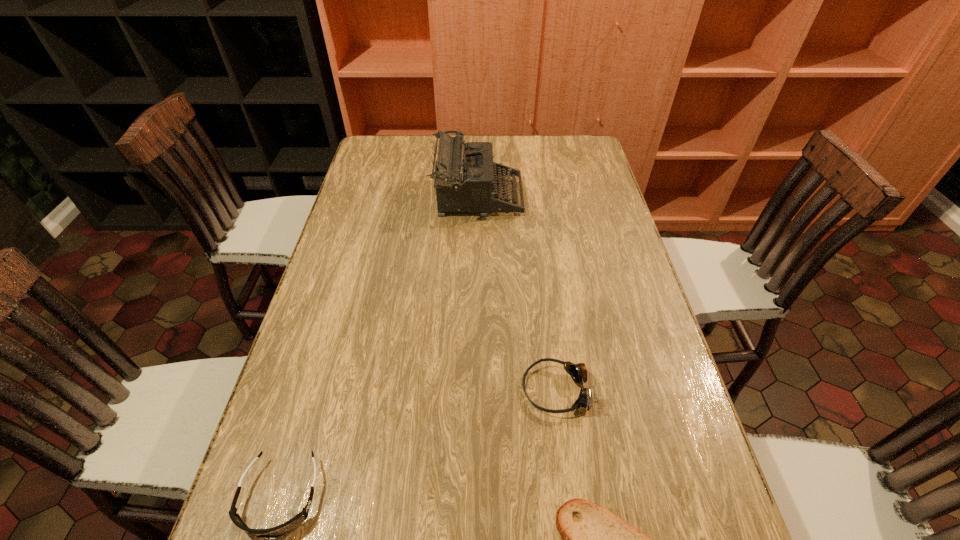
The width and height of the screenshot is (960, 540). What are the coordinates of `vacant space at the right edge of the desktop` in the screenshot? It's located at (567, 195).

Find the location of a particular element. free area in between the tallest object and the right goggles is located at coordinates (517, 293).

Identify the location of object that is the third closest to the shortest object. The height and width of the screenshot is (540, 960). click(x=465, y=175).

Select which object is the third closest to the shorter goggles. Please provide its 2D coordinates. Your answer should be formatted as a tuple, i.e. [(x, y)], where the tuple contains the x and y coordinates of a point satisfying the conditions above.

[(465, 175)]